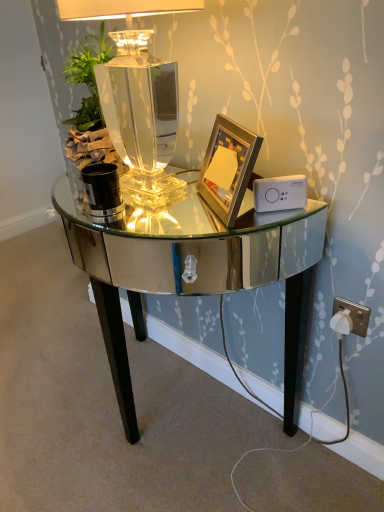
Question: Considering the positions of clear glass lamp at center and gold metallic picture frame at center in the image, is clear glass lamp at center wider or thinner than gold metallic picture frame at center?

Choices:
 (A) thin
 (B) wide

Answer: (B)

Question: Is point (142, 131) closer or farther from the camera than point (215, 144)?

Choices:
 (A) closer
 (B) farther

Answer: (B)

Question: Which object is positioned farthest from the white plastic ipod at right?

Choices:
 (A) clear glass lamp at center
 (B) shiny mirrored desk at center
 (C) gold metallic picture frame at center

Answer: (B)

Question: Which is farther from the clear glass lamp at center?

Choices:
 (A) gold metallic picture frame at center
 (B) shiny mirrored desk at center
 (C) white plastic ipod at right

Answer: (B)